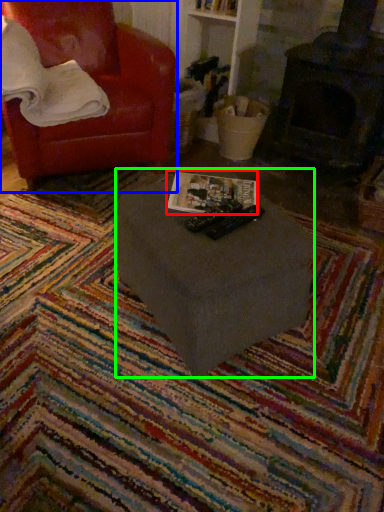
Question: Which is nearer to the magazine (highlighted by a red box)? chair (highlighted by a blue box) or table (highlighted by a green box).

Choices:
 (A) chair
 (B) table

Answer: (B)